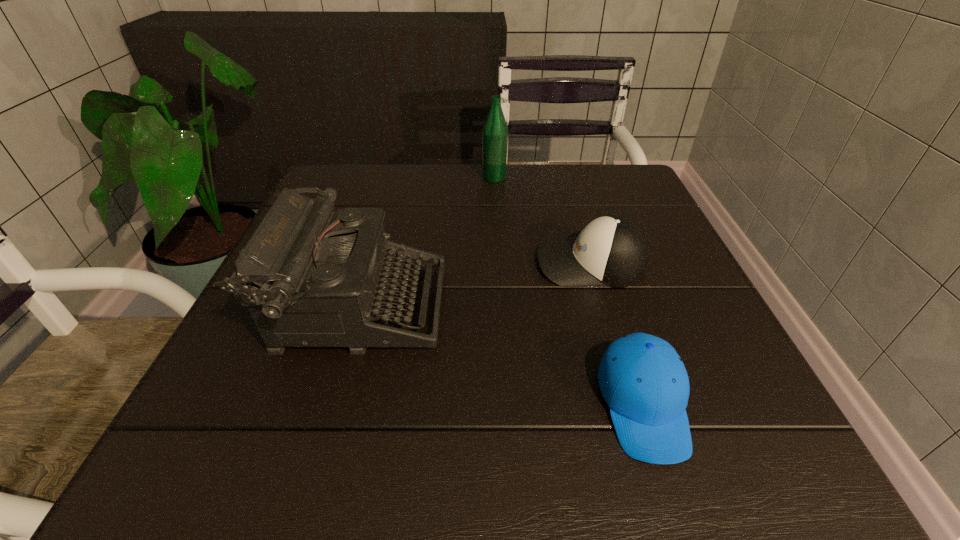
Locate an element on the screen. free space between the bottle and the second shortest object is located at coordinates (542, 221).

You are a GUI agent. You are given a task and a screenshot of the screen. Output one action in this format:
    pyautogui.click(x=<x>, y=<y>)
    Task: Click on the object that can be found as the second closest to the leftmost object
    
    Given the screenshot: What is the action you would take?
    pyautogui.click(x=643, y=380)

Locate an element on the screen. The image size is (960, 540). object that stands as the second closest to the shorter cap is located at coordinates (317, 277).

Where is `vacant space that satisfies the following two spatial constraints: 1. on the front side of the third object from right to left; 2. on the typing side of the leftmost object`? The width and height of the screenshot is (960, 540). vacant space that satisfies the following two spatial constraints: 1. on the front side of the third object from right to left; 2. on the typing side of the leftmost object is located at coordinates (501, 307).